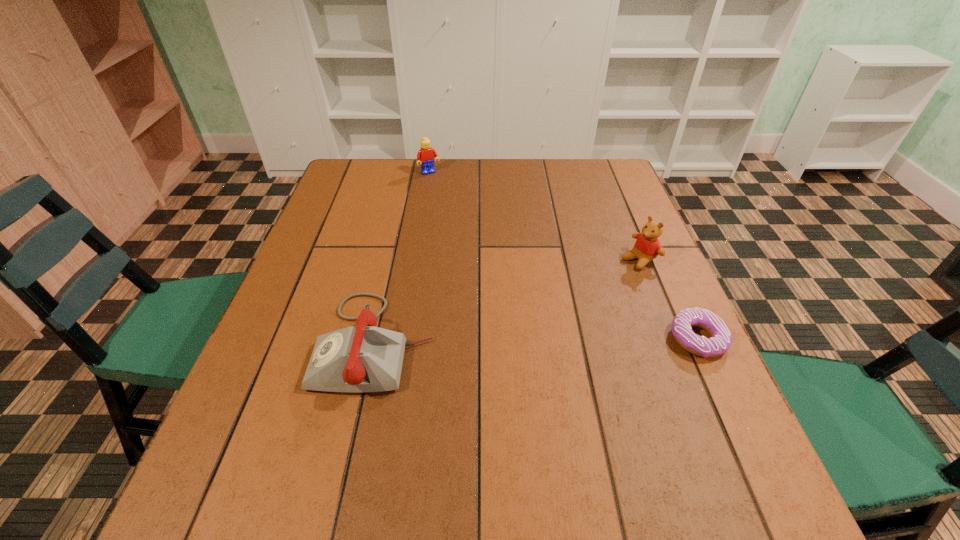
The height and width of the screenshot is (540, 960). What are the coordinates of `blank region between the third nearest object and the farthest object` in the screenshot? It's located at (534, 216).

Identify the location of vacant space in between the shortest object and the third tallest object. This screenshot has height=540, width=960. (537, 341).

The height and width of the screenshot is (540, 960). I want to click on unoccupied area between the third tallest object and the teddy bear, so click(508, 301).

Identify which object is located as the nearest to the second shortest object. Please provide its 2D coordinates. Your answer should be formatted as a tuple, i.e. [(x, y)], where the tuple contains the x and y coordinates of a point satisfying the conditions above.

[(647, 247)]

Find the location of a particular element. object that can be found as the closest to the doughnut is located at coordinates (647, 247).

The height and width of the screenshot is (540, 960). I want to click on free space that satisfies the following two spatial constraints: 1. on the front side of the shortest object; 2. on the right side of the second farthest object, so click(x=671, y=340).

This screenshot has height=540, width=960. I want to click on vacant space that satisfies the following two spatial constraints: 1. on the front side of the Lego; 2. on the right side of the third nearest object, so click(x=415, y=259).

Where is `free region that satisfies the following two spatial constraints: 1. on the front side of the doughnut; 2. on the left side of the Lego`? free region that satisfies the following two spatial constraints: 1. on the front side of the doughnut; 2. on the left side of the Lego is located at coordinates (401, 340).

I want to click on vacant space that satisfies the following two spatial constraints: 1. on the front side of the farthest object; 2. on the right side of the third nearest object, so click(x=415, y=259).